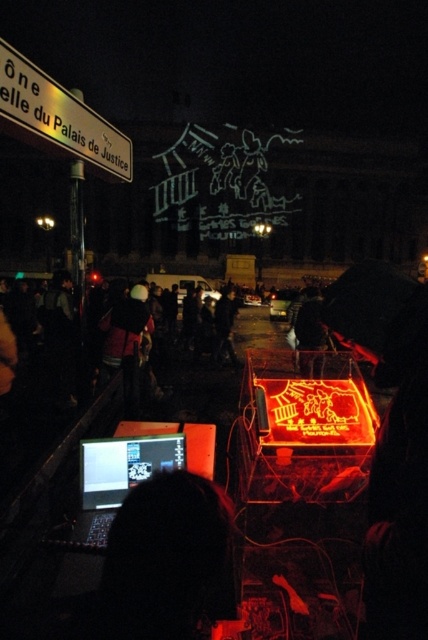
Question: Which object is farther from the camera taking this photo?

Choices:
 (A) matte black laptop at lower left
 (B) metallic silver sign at upper left
 (C) black matte laptop at lower left

Answer: (B)

Question: Which point is farther to the camera?

Choices:
 (A) (35, 74)
 (B) (112, 484)
 (C) (118, 577)

Answer: (A)

Question: Can you confirm if black matte laptop at lower left is positioned to the left of metallic silver sign at upper left?

Choices:
 (A) no
 (B) yes

Answer: (A)

Question: Which of the following is the closest to the observer?

Choices:
 (A) matte black laptop at lower left
 (B) metallic silver sign at upper left
 (C) black matte laptop at lower left

Answer: (C)

Question: In this image, where is black matte laptop at lower left located relative to metallic silver sign at upper left?

Choices:
 (A) left
 (B) right

Answer: (B)

Question: In this image, where is metallic silver sign at upper left located relative to matte black laptop at lower left?

Choices:
 (A) left
 (B) right

Answer: (A)